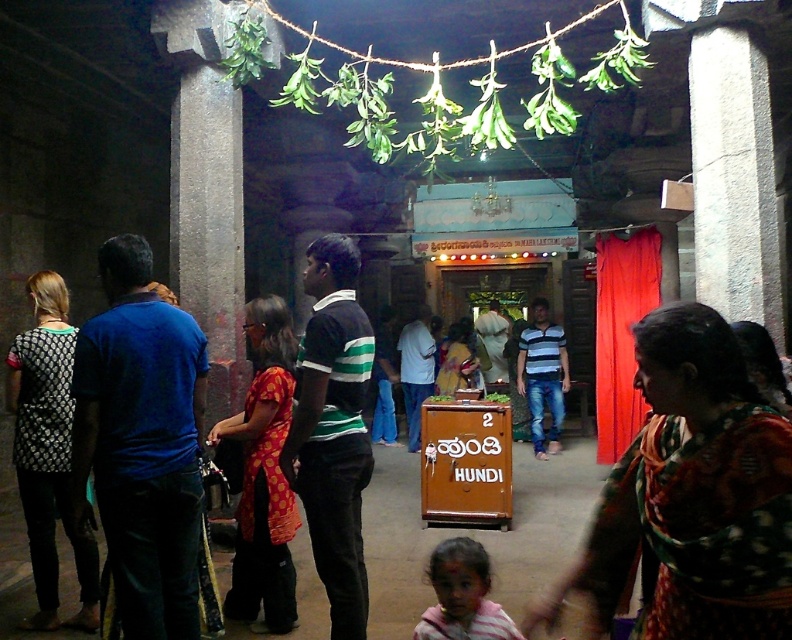
You are a visitor at the temple and want to donate money to the Hundi. You see the printed silk saree at center and the striped cotton hoodie at lower center. Which object is closer to you?

The printed silk saree at center is closer to you because it is in front of the striped cotton hoodie at lower center.